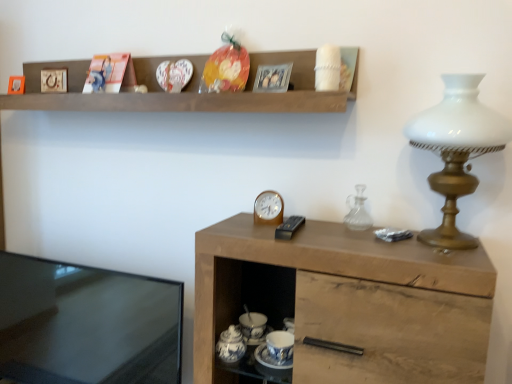
This screenshot has height=384, width=512. I want to click on vacant area that is in front of transparent glass carafe at right, so click(x=373, y=248).